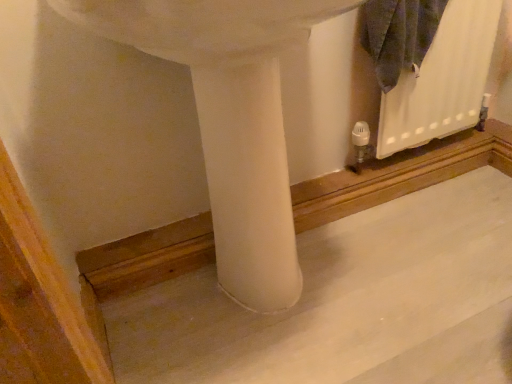
The image size is (512, 384). In order to click on free point below white matte radiator at upper right (from a real-world perspective) in this screenshot , I will do point(419,152).